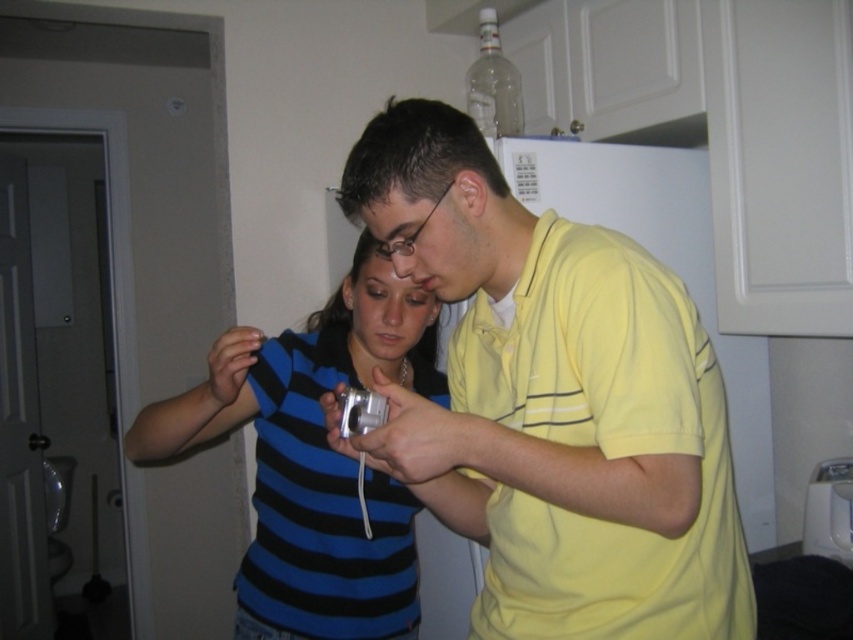
Who is lower down, blue striped shirt at center or silver metallic game controller at center?

blue striped shirt at center

Is blue striped shirt at center wider than silver metallic game controller at center?

Indeed, blue striped shirt at center has a greater width compared to silver metallic game controller at center.

Does point (369, 285) lie behind point (341, 435)?

Yes, it is behind point (341, 435).

Locate an element on the screen. The image size is (853, 640). blue striped shirt at center is located at coordinates (315, 460).

Does yellow cotton shirt at center appear on the right side of blue striped shirt at center?

Yes, yellow cotton shirt at center is to the right of blue striped shirt at center.

Identify the location of yellow cotton shirt at center. (556, 400).

How far apart are yellow cotton shirt at center and silver metallic game controller at center?

9.55 inches

Which is more to the right, yellow cotton shirt at center or silver metallic game controller at center?

From the viewer's perspective, yellow cotton shirt at center appears more on the right side.

Does point (503, 572) lie behind point (352, 420)?

Yes.

Locate an element on the screen. yellow cotton shirt at center is located at coordinates (556, 400).